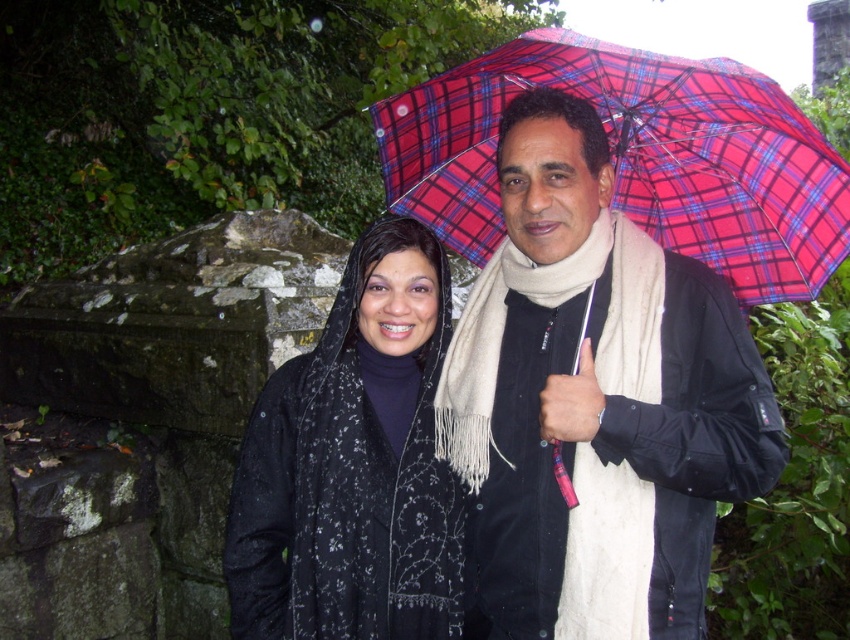
Where is `matte black jacket at center`? matte black jacket at center is located at coordinates (596, 401).

How distant is matte black jacket at center from plaid fabric umbrella at upper center?

matte black jacket at center is 22.78 inches away from plaid fabric umbrella at upper center.

Is point (533, 371) positioned in front of point (808, 291)?

Yes, it is in front of point (808, 291).

Where is `matte black jacket at center`? The width and height of the screenshot is (850, 640). matte black jacket at center is located at coordinates (596, 401).

Is matte black jacket at center positioned behind black textured scarf at center?

No, matte black jacket at center is closer to the viewer.

Who is taller, matte black jacket at center or black textured scarf at center?

With more height is matte black jacket at center.

Locate an element on the screen. This screenshot has height=640, width=850. matte black jacket at center is located at coordinates (596, 401).

Is plaid fabric umbrella at upper center thinner than black textured scarf at center?

No.

Is plaid fabric umbrella at upper center closer to the viewer compared to black textured scarf at center?

Yes, plaid fabric umbrella at upper center is in front of black textured scarf at center.

Between point (445, 220) and point (384, 368), which one is positioned behind?

The point (445, 220) is behind.

You are a GUI agent. You are given a task and a screenshot of the screen. Output one action in this format:
    pyautogui.click(x=<x>, y=<y>)
    Task: Click on the plaid fabric umbrella at upper center
    The height and width of the screenshot is (640, 850).
    Given the screenshot: What is the action you would take?
    pyautogui.click(x=633, y=157)